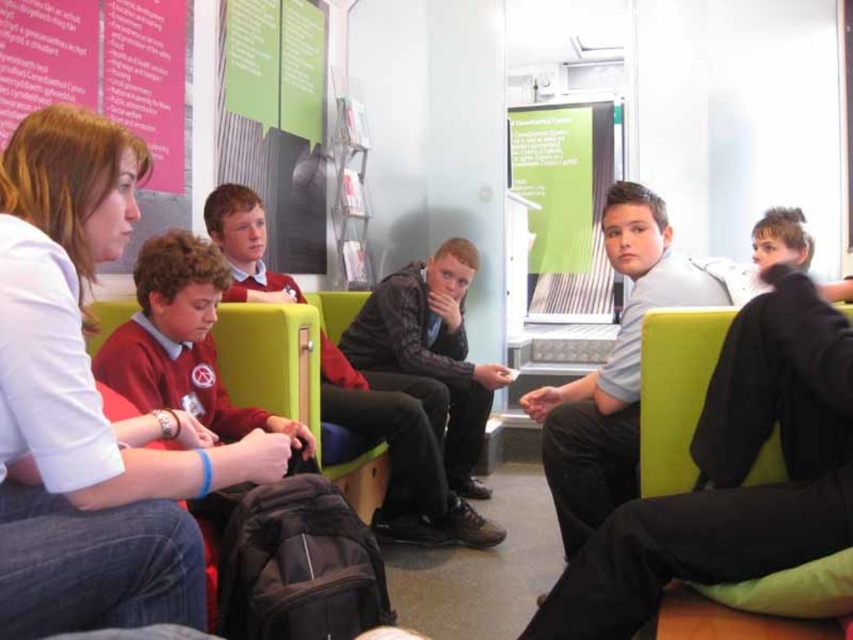
You are a photographer trying to capture a candid shot of the red sweater at left and the light gray shirt at center. Since you want to ensure both subjects are in focus, you need to know which one is shorter. Which object is shorter?

The red sweater at left is shorter than the light gray shirt at center.

You are a photographer standing in front of the scene. You need to capture a photo that includes both the light gray shirt at center and the dark gray jacket at center. Which object should be placed closer to the camera to ensure both are fully visible in the frame?

The light gray shirt at center is much taller than the dark gray jacket at center. To ensure both are fully visible in the frame, the photographer should place the light gray shirt at center closer to the camera so that its full height can be captured without cropping.

You are a photographer standing in the center of the room. You want to take a photo of the light gray shirt at center and dark gray jacket at center. The camera has a minimum focus distance of 30 inches. Will both subjects be in focus?

The light gray shirt at center is 32.83 inches from dark gray jacket at center. Since the distance between them is greater than the camera minimum focus distance of 30 inches, both subjects will be in focus.